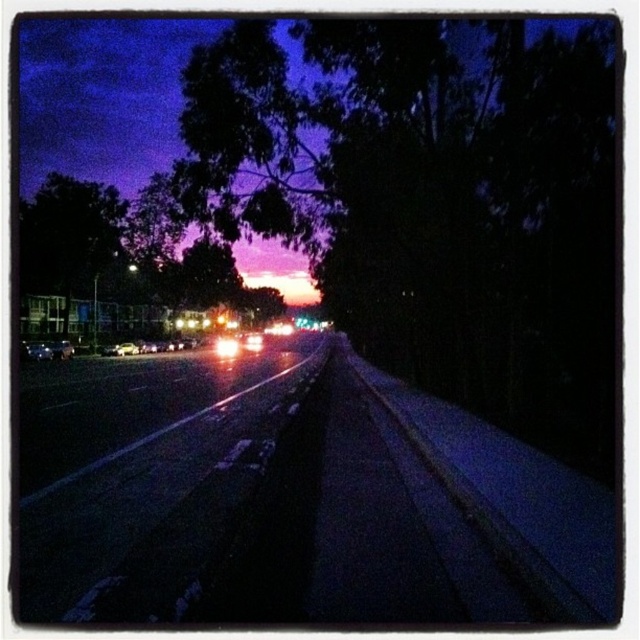
You are driving at night and see the metallic reflective road at center and the green leafy tree at center. Which one appears wider from your perspective?

The green leafy tree at center appears wider because the metallic reflective road at center has a smaller width than it.

You are driving a car at night and see the road ahead. There is a point marked at coordinates point (157, 492). Where is this point located?

The point (157, 492) is on the metallic reflective road at center.